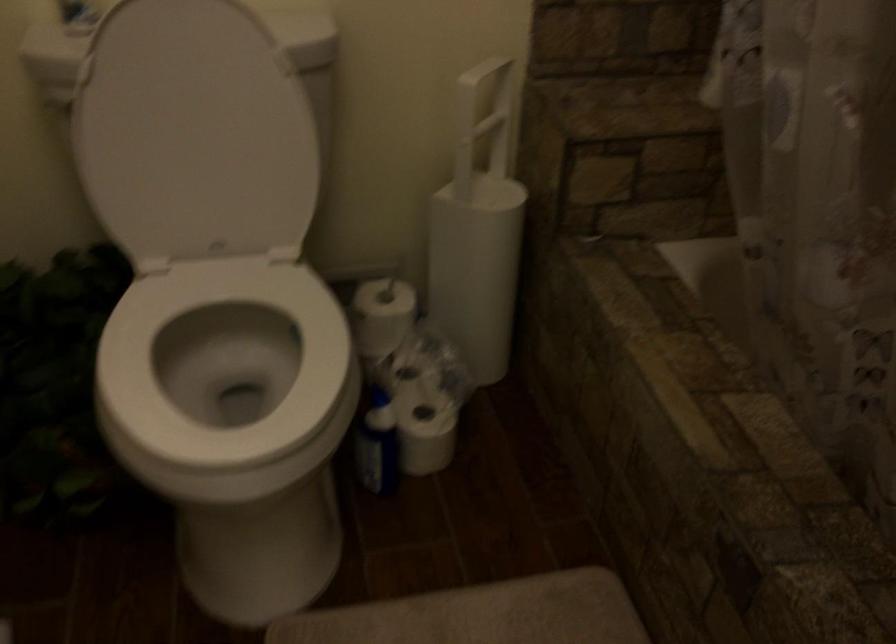
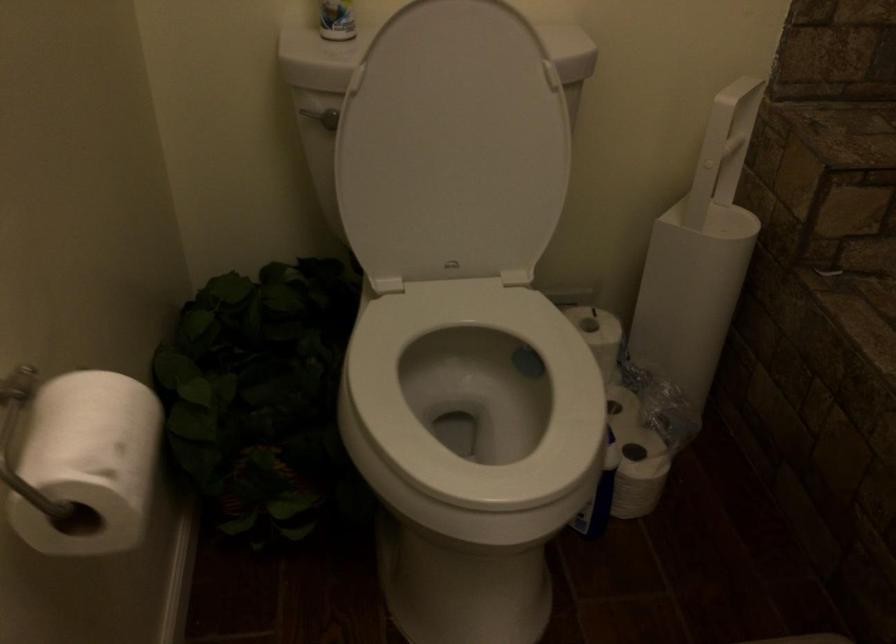
Question: The camera is either moving clockwise (left) or counter-clockwise (right) around the object. The first image is from the beginning of the video and the second image is from the end. Is the camera moving left or right when shooting the video?

Choices:
 (A) Left
 (B) Right

Answer: (B)